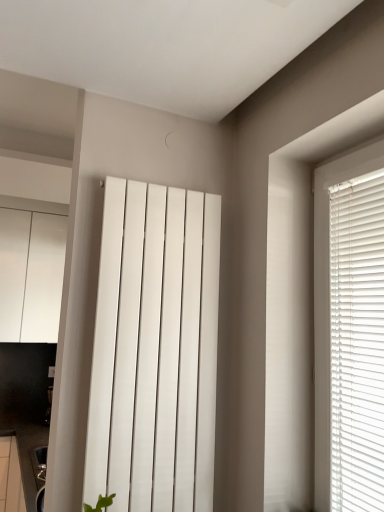
Question: Considering the relative sizes of white glossy cabinet at left and white smooth radiator at center in the image provided, is white glossy cabinet at left bigger than white smooth radiator at center?

Choices:
 (A) yes
 (B) no

Answer: (A)

Question: Is white glossy cabinet at left outside white smooth radiator at center?

Choices:
 (A) no
 (B) yes

Answer: (B)

Question: Does white glossy cabinet at left appear on the left side of white smooth radiator at center?

Choices:
 (A) yes
 (B) no

Answer: (A)

Question: From the image's perspective, is white glossy cabinet at left located above white smooth radiator at center?

Choices:
 (A) yes
 (B) no

Answer: (A)

Question: Does white glossy cabinet at left have a lesser width compared to white smooth radiator at center?

Choices:
 (A) yes
 (B) no

Answer: (B)

Question: Does white glossy cabinet at left have a smaller size compared to white smooth radiator at center?

Choices:
 (A) yes
 (B) no

Answer: (B)

Question: Is the surface of white smooth radiator at center in direct contact with white glossy cabinet at left?

Choices:
 (A) yes
 (B) no

Answer: (B)

Question: From the image's perspective, is white smooth radiator at center under white glossy cabinet at left?

Choices:
 (A) yes
 (B) no

Answer: (A)

Question: From a real-world perspective, is white smooth radiator at center below white glossy cabinet at left?

Choices:
 (A) no
 (B) yes

Answer: (B)

Question: Is white smooth radiator at center looking in the opposite direction of white glossy cabinet at left?

Choices:
 (A) yes
 (B) no

Answer: (A)

Question: Is white smooth radiator at center further to the viewer compared to white glossy cabinet at left?

Choices:
 (A) yes
 (B) no

Answer: (B)

Question: From the image's perspective, would you say white smooth radiator at center is positioned over white glossy cabinet at left?

Choices:
 (A) yes
 (B) no

Answer: (B)

Question: From a real-world perspective, is white glossy cabinet at left positioned above or below white smooth radiator at center?

Choices:
 (A) above
 (B) below

Answer: (A)